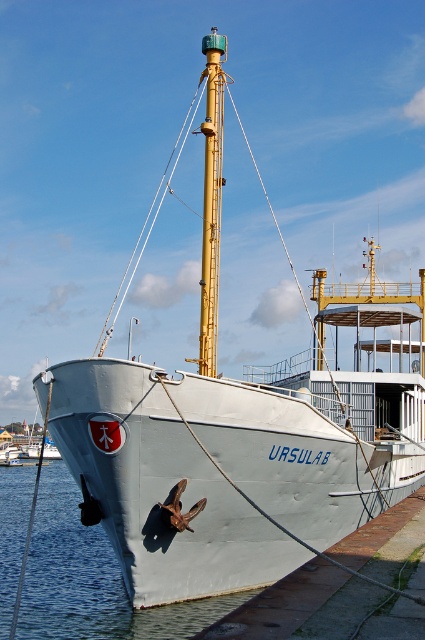
Question: Does metallic gray water at lower left have a smaller size compared to yellow metallic mast at center?

Choices:
 (A) no
 (B) yes

Answer: (A)

Question: Among these objects, which one is nearest to the camera?

Choices:
 (A) metallic gray water at lower left
 (B) yellow metallic mast at center

Answer: (A)

Question: Is metallic gray water at lower left closer to the viewer compared to yellow metallic mast at center?

Choices:
 (A) yes
 (B) no

Answer: (A)

Question: Among these objects, which one is farthest from the camera?

Choices:
 (A) metallic gray water at lower left
 (B) yellow metallic mast at center

Answer: (B)

Question: Does metallic gray water at lower left have a larger size compared to yellow metallic mast at center?

Choices:
 (A) yes
 (B) no

Answer: (A)

Question: Which object appears farthest from the camera in this image?

Choices:
 (A) metallic gray water at lower left
 (B) yellow metallic mast at center

Answer: (B)